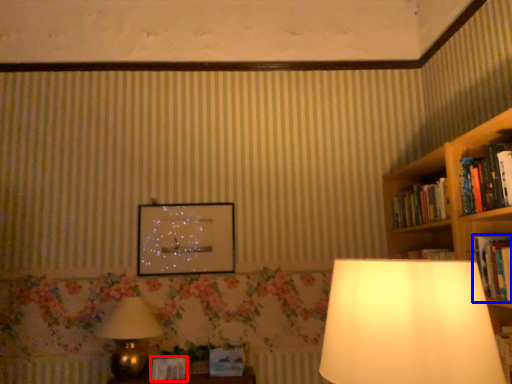
Question: Which point is closer to the camera, paperback book (highlighted by a red box) or book (highlighted by a blue box)?

Choices:
 (A) paperback book
 (B) book

Answer: (B)